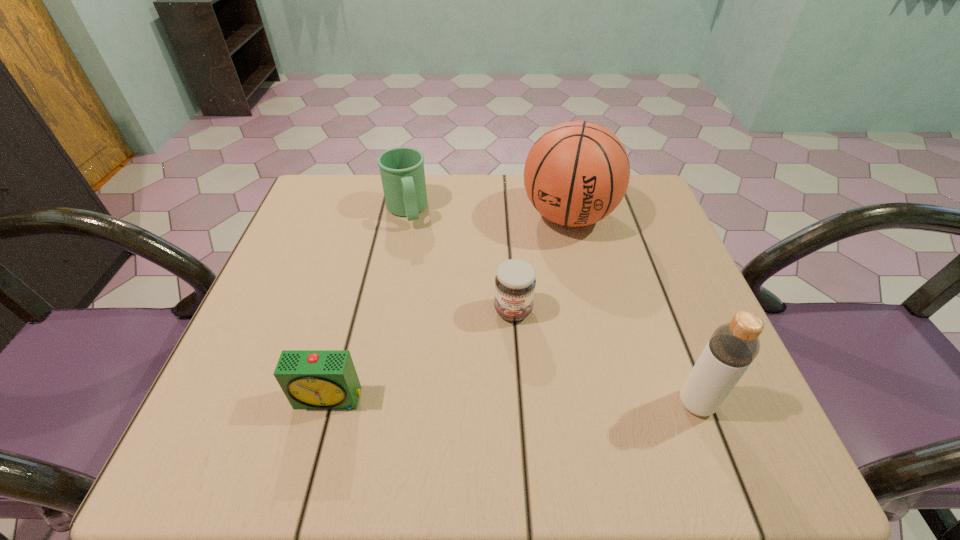
The height and width of the screenshot is (540, 960). Identify the location of vacant space at the far right corner of the desktop. (648, 187).

Locate an element on the screen. The width and height of the screenshot is (960, 540). blank space at the near right corner of the desktop is located at coordinates (678, 381).

At what (x,y) coordinates should I click in order to perform the action: click on free point between the third farthest object and the basketball. Please return your answer as a coordinate pair (x, y). Looking at the image, I should click on (540, 264).

Identify the location of free space that is in between the basketball and the third tallest object. (488, 214).

I want to click on free space between the bottle and the alarm clock, so click(513, 401).

The image size is (960, 540). Find the location of `vacant area that lies between the third farthest object and the mug`. vacant area that lies between the third farthest object and the mug is located at coordinates (460, 261).

Locate an element on the screen. This screenshot has height=540, width=960. vacant space that's between the bottle and the basketball is located at coordinates (633, 310).

The height and width of the screenshot is (540, 960). I want to click on free space between the third farthest object and the third shortest object, so click(x=460, y=261).

At what (x,y) coordinates should I click in order to perform the action: click on free point between the alarm clock and the mug. Please return your answer as a coordinate pair (x, y). This screenshot has width=960, height=540. Looking at the image, I should click on (368, 305).

The width and height of the screenshot is (960, 540). What are the coordinates of `vacant area that lies between the basketball and the alarm clock` in the screenshot? It's located at (449, 307).